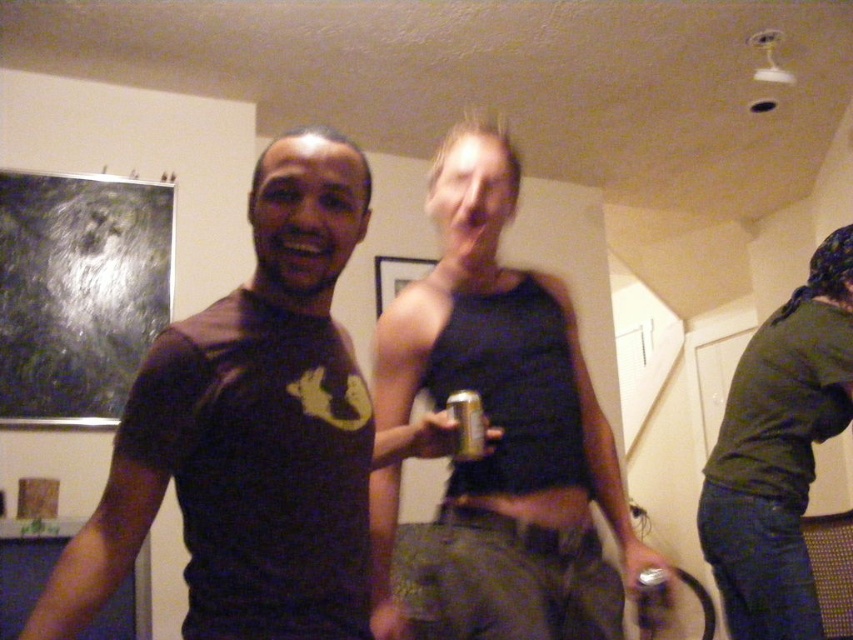
You are standing at the camera position and want to know how far the point at coordinates (260, 600) is from you. Can you determine the distance?

The point at coordinates (260, 600) is 36.77 inches away from the camera position.